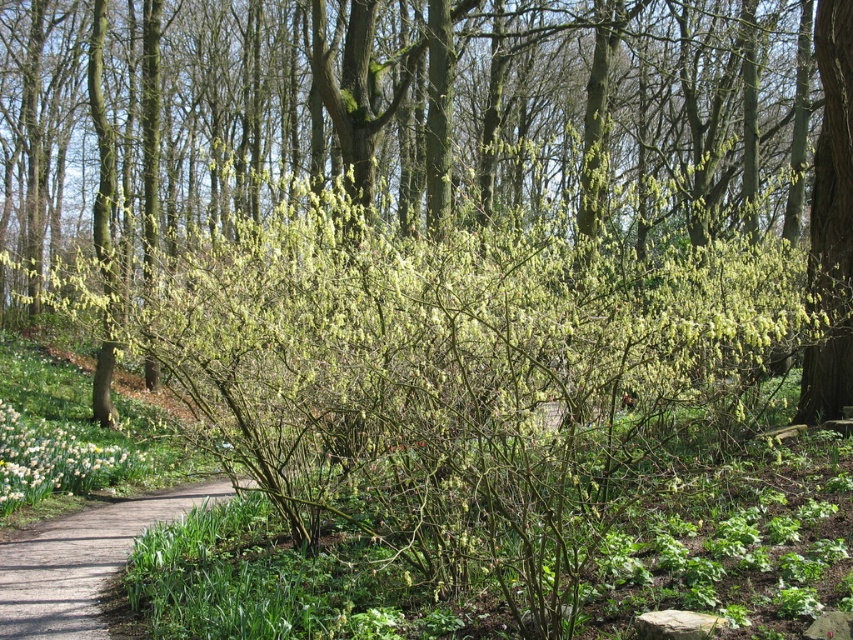
Between green leafy bush at center and white glossy flower at lower left, which one is positioned lower?

white glossy flower at lower left

Is green leafy bush at center taller than white glossy flower at lower left?

Yes, green leafy bush at center is taller than white glossy flower at lower left.

Image resolution: width=853 pixels, height=640 pixels. I want to click on green leafy bush at center, so click(433, 125).

This screenshot has width=853, height=640. Find the location of `green leafy bush at center`. green leafy bush at center is located at coordinates (433, 125).

Can you confirm if brown gravel path at lower left is positioned to the right of green leafy bush at right?

Incorrect, brown gravel path at lower left is not on the right side of green leafy bush at right.

Who is positioned more to the right, brown gravel path at lower left or green leafy bush at right?

green leafy bush at right is more to the right.

Does point (68, 541) come farther from viewer compared to point (834, 344)?

That is False.

Identify the location of brown gravel path at lower left. The width and height of the screenshot is (853, 640). (80, 563).

Which is in front, point (270, 60) or point (805, 358)?

Positioned in front is point (805, 358).

Can you confirm if green leafy bush at center is positioned below green leafy bush at right?

Actually, green leafy bush at center is above green leafy bush at right.

Describe the element at coordinates (433, 125) in the screenshot. I see `green leafy bush at center` at that location.

Locate an element on the screen. green leafy bush at center is located at coordinates (433, 125).